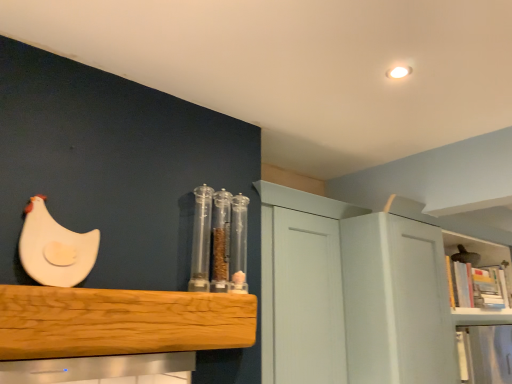
Question: Is wooden bookshelf at upper right, the 2th shelf viewed from the front, to the left or to the right of transparent plastic containers at center in the image?

Choices:
 (A) left
 (B) right

Answer: (B)

Question: From a real-world perspective, is wooden bookshelf at upper right, the 1th shelf positioned from the right, positioned above or below transparent plastic containers at center?

Choices:
 (A) above
 (B) below

Answer: (B)

Question: Which object is positioned farthest from the white matte chicken at upper left, placed as the second chicken when sorted from top to bottom?

Choices:
 (A) transparent plastic containers at center
 (B) white matte cabinet at upper right
 (C) natural wood shelf at center, arranged as the 2th shelf when viewed from the right
 (D) wooden bookshelf at upper right, which ranks as the 2th shelf in left-to-right order
 (E) white matte chicken at left, the 1th chicken from the top

Answer: (E)

Question: Estimate the real-world distances between objects in this image. Which object is farther from the natural wood shelf at center, the first shelf in the front-to-back sequence?

Choices:
 (A) wooden bookshelf at upper right, the 2th shelf viewed from the front
 (B) transparent plastic containers at center
 (C) white matte chicken at left, which is the 1th chicken in left-to-right order
 (D) white matte cabinet at upper right
 (E) white matte chicken at upper left, acting as the first chicken starting from the bottom

Answer: (E)